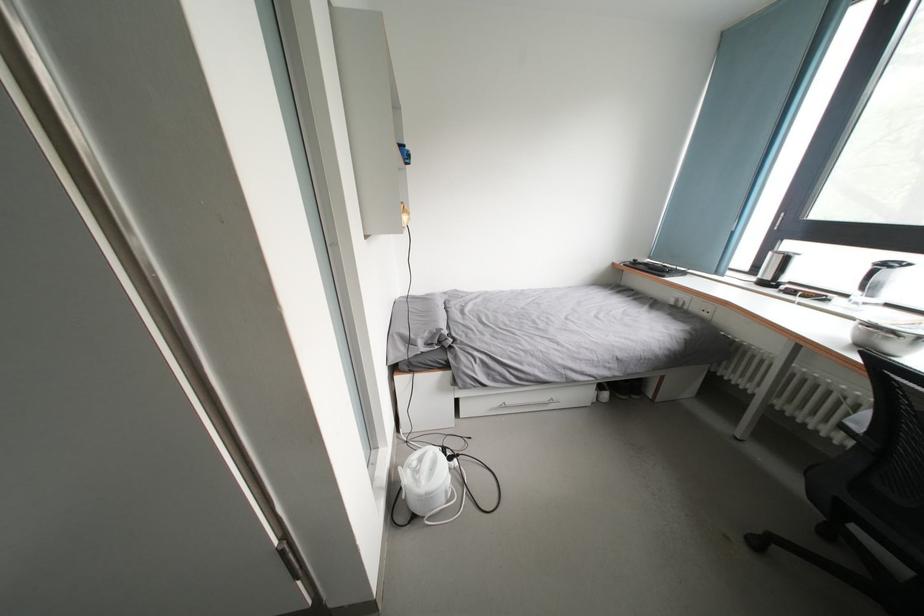
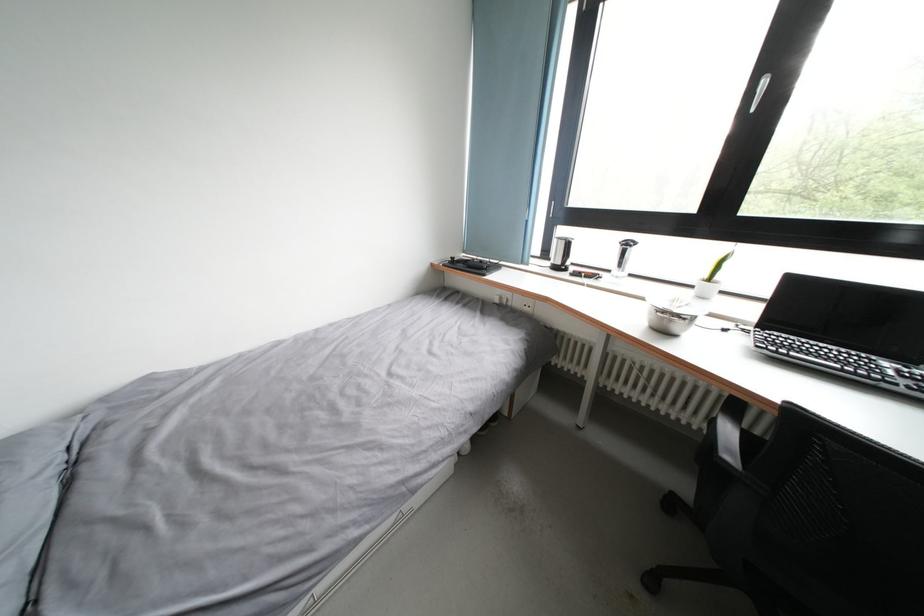
Question: The images are taken continuously from a first-person perspective. In which direction is your viewpoint rotating?

Choices:
 (A) Left
 (B) Right
 (C) Up
 (D) Down

Answer: (B)